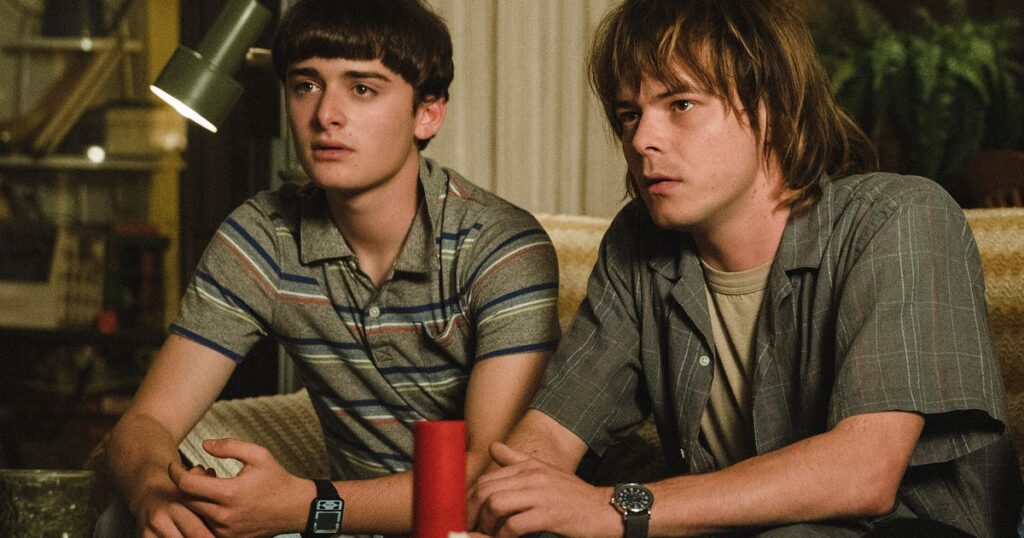
Identify the location of shelves. (42, 160), (47, 52).